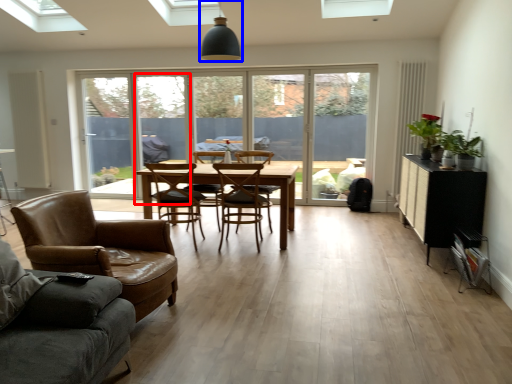
Question: Which object is closer to the camera taking this photo, screen door (highlighted by a red box) or light fixture (highlighted by a blue box)?

Choices:
 (A) screen door
 (B) light fixture

Answer: (B)